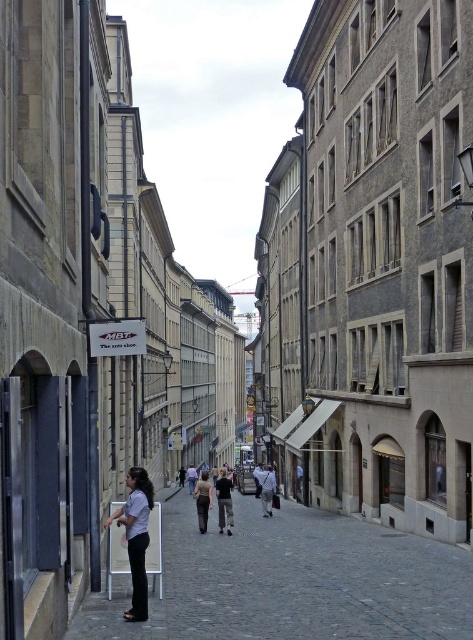
Question: Which point appears farthest from the camera in this image?

Choices:
 (A) (349, 547)
 (B) (132, 544)

Answer: (A)

Question: Is white paper at center smaller than light brown fabric shirt at center?

Choices:
 (A) no
 (B) yes

Answer: (A)

Question: Among these points, which one is nearest to the camera?

Choices:
 (A) (96, 612)
 (B) (130, 502)

Answer: (B)

Question: Which point is closer to the camera?

Choices:
 (A) white paper at center
 (B) light brown fabric shirt at center

Answer: (A)

Question: Is white paper at center wider than light brown fabric shirt at center?

Choices:
 (A) yes
 (B) no

Answer: (A)

Question: Is white paper at center positioned in front of light brown fabric shirt at center?

Choices:
 (A) no
 (B) yes

Answer: (B)